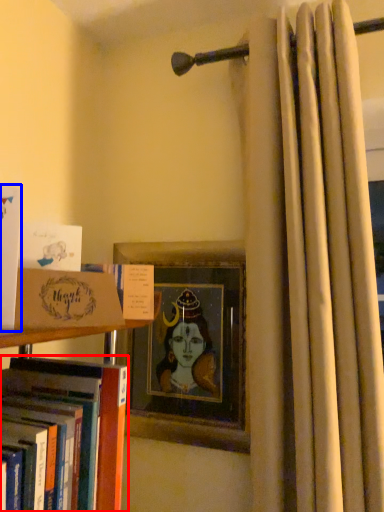
Question: Among these objects, which one is farthest to the camera, book (highlighted by a red box) or book (highlighted by a blue box)?

Choices:
 (A) book
 (B) book

Answer: (B)